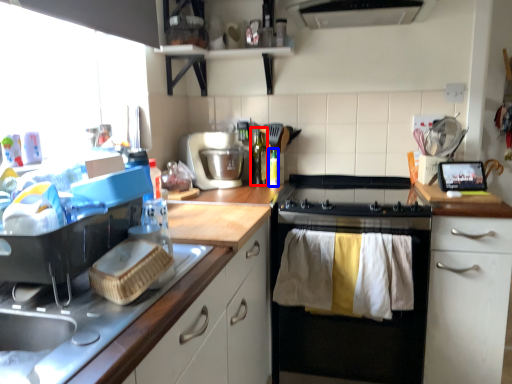
Question: Among these objects, which one is farthest to the camera, bottle (highlighted by a red box) or bottle (highlighted by a blue box)?

Choices:
 (A) bottle
 (B) bottle

Answer: (A)